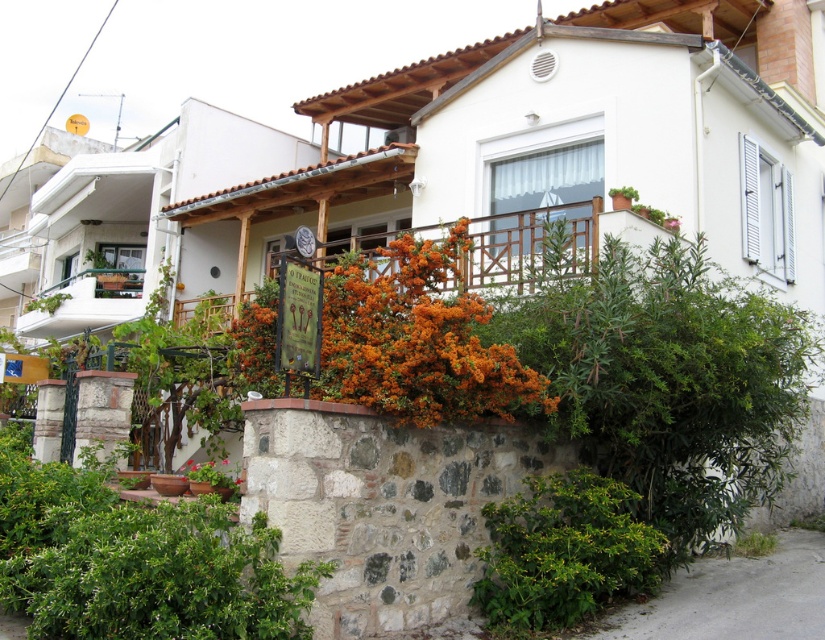
How distant is orange matte flowers at center from green leafy plant at lower center?

The distance of orange matte flowers at center from green leafy plant at lower center is 5.97 meters.

Who is taller, orange matte flowers at center or green leafy plant at lower center?

orange matte flowers at center

Is point (462, 330) closer to viewer compared to point (185, 476)?

Yes, it is in front of point (185, 476).

Locate an element on the screen. This screenshot has width=825, height=640. orange matte flowers at center is located at coordinates (417, 340).

Is green leafy bush at lower center thinner than green leafy plant at lower right?

In fact, green leafy bush at lower center might be wider than green leafy plant at lower right.

The height and width of the screenshot is (640, 825). Describe the element at coordinates (562, 552) in the screenshot. I see `green leafy bush at lower center` at that location.

Where is `green leafy bush at lower center`? The width and height of the screenshot is (825, 640). green leafy bush at lower center is located at coordinates (562, 552).

Is orange matte flowers at center below white painted wood at left?

Yes.

Identify the location of orange matte flowers at center. (417, 340).

This screenshot has height=640, width=825. I want to click on orange matte flowers at center, so click(x=417, y=340).